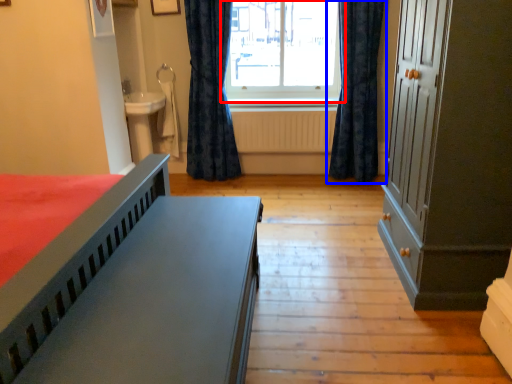
Question: Which object is closer to the camera taking this photo, window (highlighted by a red box) or curtain (highlighted by a blue box)?

Choices:
 (A) window
 (B) curtain

Answer: (B)